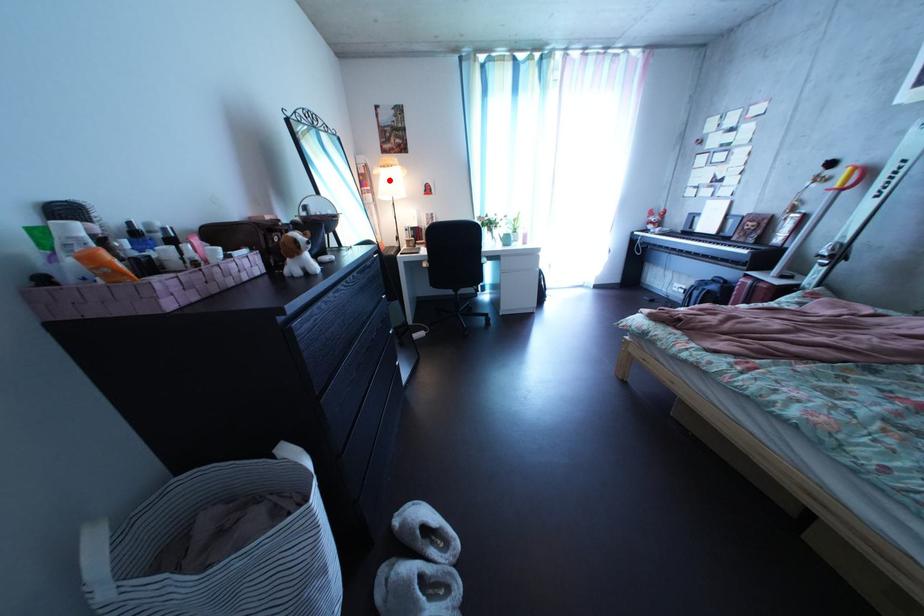
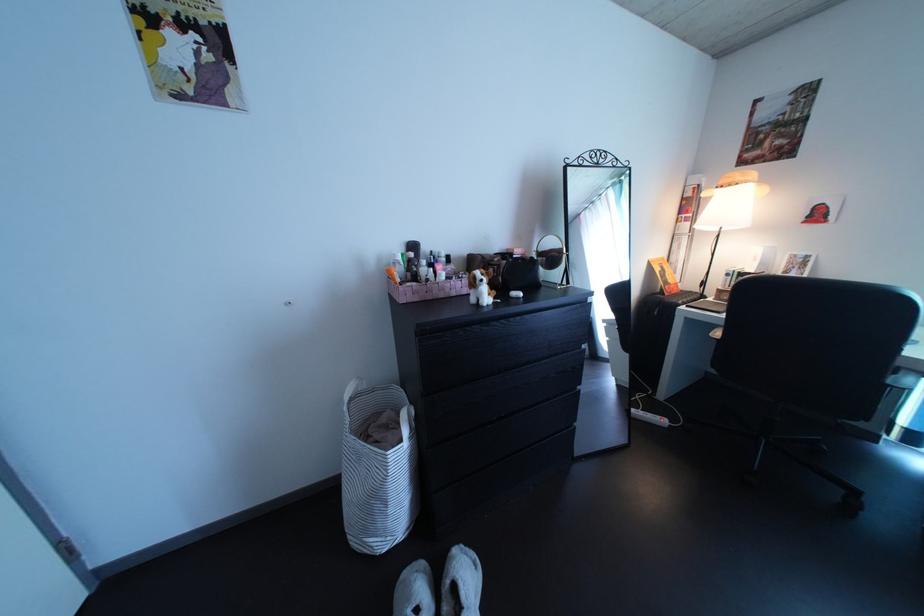
Where in the second image is the point corresponding to the highlighted location from the first image?

(719, 203)